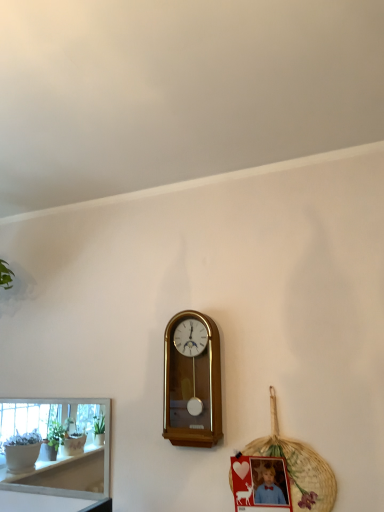
You are a GUI agent. You are given a task and a screenshot of the screen. Output one action in this format:
    pyautogui.click(x=<x>, y=<y>)
    Task: Click on the matte plastic picture frame at lower right
    
    Given the screenshot: What is the action you would take?
    pyautogui.click(x=260, y=483)

Find the location of a particular element. woven straw basket at lower right is located at coordinates (298, 466).

This screenshot has height=512, width=384. I want to click on white glossy shelf at lower left, so click(61, 446).

Locate an element on the screen. This screenshot has height=512, width=384. matte plastic picture frame at lower right is located at coordinates (260, 483).

In terms of height, does matte plastic picture frame at lower right look taller or shorter compared to white glossy shelf at lower left?

In the image, matte plastic picture frame at lower right appears to be shorter than white glossy shelf at lower left.

Image resolution: width=384 pixels, height=512 pixels. I want to click on shelf behind the matte plastic picture frame at lower right, so click(x=61, y=446).

Based on their sizes in the image, would you say matte plastic picture frame at lower right is bigger or smaller than white glossy shelf at lower left?

matte plastic picture frame at lower right is smaller than white glossy shelf at lower left.

Is point (70, 467) behind point (219, 347)?

Yes, it is behind point (219, 347).

The width and height of the screenshot is (384, 512). I want to click on shelf behind the wooden wall clock at center, so click(61, 446).

Does white glossy shelf at lower left have a lesser width compared to wooden wall clock at center?

Yes, white glossy shelf at lower left is thinner than wooden wall clock at center.

Between white glossy shelf at lower left and wooden wall clock at center, which one is positioned in front?

wooden wall clock at center is closer to the camera.

From the image's perspective, is woven straw basket at lower right below white glossy shelf at lower left?

Actually, woven straw basket at lower right appears above white glossy shelf at lower left in the image.

Considering the positions of objects woven straw basket at lower right and white glossy shelf at lower left in the image provided, who is behind, woven straw basket at lower right or white glossy shelf at lower left?

white glossy shelf at lower left is behind.

Who is bigger, woven straw basket at lower right or white glossy shelf at lower left?

With larger size is white glossy shelf at lower left.

Which point is more distant from viewer, (335, 489) or (97, 400)?

Positioned behind is point (97, 400).

From a real-world perspective, is wooden wall clock at center located higher than white glossy shelf at lower left?

Yes, from a real-world perspective, wooden wall clock at center is on top of white glossy shelf at lower left.

Can you confirm if wooden wall clock at center is shorter than white glossy shelf at lower left?

In fact, wooden wall clock at center may be taller than white glossy shelf at lower left.

This screenshot has height=512, width=384. Find the location of `wall clock above the white glossy shelf at lower left (from the image's perspective)`. wall clock above the white glossy shelf at lower left (from the image's perspective) is located at coordinates (192, 381).

Does wooden wall clock at center appear on the left side of white glossy shelf at lower left?

No, wooden wall clock at center is not to the left of white glossy shelf at lower left.

Which object is positioned more to the right, wooden wall clock at center or woven straw basket at lower right?

From the viewer's perspective, woven straw basket at lower right appears more on the right side.

Based on the photo, which is correct: wooden wall clock at center is inside woven straw basket at lower right, or outside of it?

wooden wall clock at center cannot be found inside woven straw basket at lower right.

The width and height of the screenshot is (384, 512). In order to click on basket below the wooden wall clock at center (from the image's perspective) in this screenshot , I will do `click(298, 466)`.

Is wooden wall clock at center in front of woven straw basket at lower right?

No, wooden wall clock at center is behind woven straw basket at lower right.

Find the location of `basket behind the matte plastic picture frame at lower right`. basket behind the matte plastic picture frame at lower right is located at coordinates (298, 466).

Are woven straw basket at lower right and matte plastic picture frame at lower right beside each other?

Yes, woven straw basket at lower right is with matte plastic picture frame at lower right.

Based on the photo, how far apart are woven straw basket at lower right and matte plastic picture frame at lower right?

A distance of 3.03 inches exists between woven straw basket at lower right and matte plastic picture frame at lower right.

Does point (306, 459) lie in front of point (283, 486)?

Yes, it is in front of point (283, 486).

Is white glossy shelf at lower left beside matte plastic picture frame at lower right?

There is a gap between white glossy shelf at lower left and matte plastic picture frame at lower right.

From a real-world perspective, which is physically above, white glossy shelf at lower left or matte plastic picture frame at lower right?

From a 3D spatial view, white glossy shelf at lower left is above.

This screenshot has height=512, width=384. I want to click on shelf to the left of matte plastic picture frame at lower right, so click(x=61, y=446).

Is white glossy shelf at lower left oriented towards matte plastic picture frame at lower right?

No.

In the image, there is a matte plastic picture frame at lower right. At what (x,y) coordinates should I click in order to perform the action: click on shelf above it (from the image's perspective). Please return your answer as a coordinate pair (x, y). Image resolution: width=384 pixels, height=512 pixels. Looking at the image, I should click on (61, 446).

You are a GUI agent. You are given a task and a screenshot of the screen. Output one action in this format:
    pyautogui.click(x=<x>, y=<y>)
    Task: Click on the shelf behind the wooden wall clock at center
    The height and width of the screenshot is (512, 384).
    Given the screenshot: What is the action you would take?
    pyautogui.click(x=61, y=446)

When comparing their distances from woven straw basket at lower right, does wooden wall clock at center or white glossy shelf at lower left seem further?

white glossy shelf at lower left is further to woven straw basket at lower right.

From the image, which object appears to be farther from woven straw basket at lower right, matte plastic picture frame at lower right or white glossy shelf at lower left?

white glossy shelf at lower left is further to woven straw basket at lower right.

When comparing their distances from wooden wall clock at center, does woven straw basket at lower right or white glossy shelf at lower left seem closer?

Based on the image, woven straw basket at lower right appears to be nearer to wooden wall clock at center.

Consider the image. Based on their spatial positions, is woven straw basket at lower right or wooden wall clock at center closer to matte plastic picture frame at lower right?

woven straw basket at lower right lies closer to matte plastic picture frame at lower right than the other object.

Which object lies nearer to the anchor point white glossy shelf at lower left, matte plastic picture frame at lower right or woven straw basket at lower right?

Based on the image, matte plastic picture frame at lower right appears to be nearer to white glossy shelf at lower left.

Estimate the real-world distances between objects in this image. Which object is closer to matte plastic picture frame at lower right, woven straw basket at lower right or white glossy shelf at lower left?

woven straw basket at lower right is positioned closer to the anchor matte plastic picture frame at lower right.

Looking at the image, which one is located closer to white glossy shelf at lower left, matte plastic picture frame at lower right or wooden wall clock at center?

Among the two, wooden wall clock at center is located nearer to white glossy shelf at lower left.

From the image, which object appears to be farther from woven straw basket at lower right, white glossy shelf at lower left or matte plastic picture frame at lower right?

Among the two, white glossy shelf at lower left is located further to woven straw basket at lower right.

Image resolution: width=384 pixels, height=512 pixels. What are the coordinates of `wall clock between white glossy shelf at lower left and matte plastic picture frame at lower right from left to right` in the screenshot? It's located at (192, 381).

The width and height of the screenshot is (384, 512). In order to click on wall clock between white glossy shelf at lower left and woven straw basket at lower right from left to right in this screenshot , I will do pyautogui.click(x=192, y=381).

You are a GUI agent. You are given a task and a screenshot of the screen. Output one action in this format:
    pyautogui.click(x=<x>, y=<y>)
    Task: Click on the picture frame between white glossy shelf at lower left and woven straw basket at lower right from left to right
    The image size is (384, 512).
    Given the screenshot: What is the action you would take?
    pyautogui.click(x=260, y=483)

What are the coordinates of `basket that lies between wooden wall clock at center and matte plastic picture frame at lower right from top to bottom` in the screenshot? It's located at (298, 466).